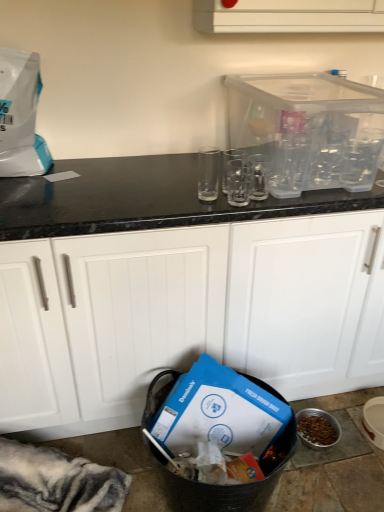
Where is `vacant space in front of clear glass at center, marked as the 1th clear in a right-to-left arrangement`? vacant space in front of clear glass at center, marked as the 1th clear in a right-to-left arrangement is located at coordinates (254, 211).